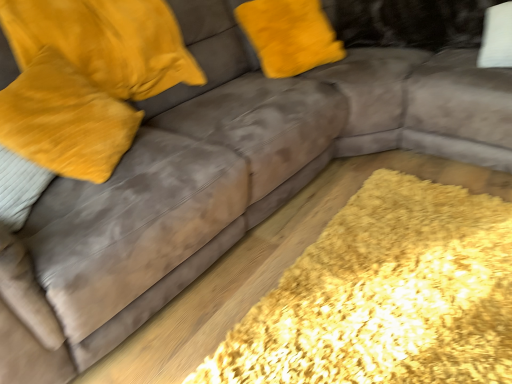
Question: Is yellow shaggy rug at lower right in front of velvet yellow pillow at left, which is counted as the first pillow, starting from the left?

Choices:
 (A) yes
 (B) no

Answer: (A)

Question: Considering the relative sizes of yellow shaggy rug at lower right and velvet yellow pillow at left, acting as the 2th pillow starting from the right, in the image provided, is yellow shaggy rug at lower right smaller than velvet yellow pillow at left, acting as the 2th pillow starting from the right,?

Choices:
 (A) yes
 (B) no

Answer: (A)

Question: Can you confirm if yellow shaggy rug at lower right is wider than velvet yellow pillow at left, which is counted as the first pillow, starting from the left?

Choices:
 (A) yes
 (B) no

Answer: (A)

Question: Is yellow shaggy rug at lower right oriented towards velvet yellow pillow at left, acting as the 2th pillow starting from the right?

Choices:
 (A) yes
 (B) no

Answer: (B)

Question: From a real-world perspective, is yellow shaggy rug at lower right on top of velvet yellow pillow at left, which is counted as the first pillow, starting from the left?

Choices:
 (A) yes
 (B) no

Answer: (B)

Question: Considering the relative positions of velvet yellow pillow at left, which is counted as the first pillow, starting from the left, and velvet yellow pillow at upper left, which appears as the 1th pillow when viewed from the right, in the image provided, is velvet yellow pillow at left, which is counted as the first pillow, starting from the left, to the left or to the right of velvet yellow pillow at upper left, which appears as the 1th pillow when viewed from the right,?

Choices:
 (A) left
 (B) right

Answer: (A)

Question: Based on their sizes in the image, would you say velvet yellow pillow at left, acting as the 2th pillow starting from the right, is bigger or smaller than velvet yellow pillow at upper left, the second pillow viewed from the left?

Choices:
 (A) big
 (B) small

Answer: (B)

Question: Is velvet yellow pillow at left, which is counted as the first pillow, starting from the left, in front of or behind velvet yellow pillow at upper left, which appears as the 1th pillow when viewed from the right, in the image?

Choices:
 (A) front
 (B) behind

Answer: (A)

Question: Is velvet yellow pillow at left, acting as the 2th pillow starting from the right, situated inside velvet yellow pillow at upper left, the second pillow viewed from the left, or outside?

Choices:
 (A) outside
 (B) inside

Answer: (A)

Question: Is velvet yellow pillow at upper left, the second pillow viewed from the left, situated inside velvet yellow pillow at left, which is counted as the first pillow, starting from the left, or outside?

Choices:
 (A) inside
 (B) outside

Answer: (B)

Question: Is velvet yellow pillow at upper left, the second pillow viewed from the left, in front of or behind velvet yellow pillow at left, acting as the 2th pillow starting from the right, in the image?

Choices:
 (A) front
 (B) behind

Answer: (B)

Question: From the image's perspective, is velvet yellow pillow at upper left, which appears as the 1th pillow when viewed from the right, located above or below velvet yellow pillow at left, which is counted as the first pillow, starting from the left?

Choices:
 (A) below
 (B) above

Answer: (B)

Question: In terms of height, does velvet yellow pillow at upper left, the second pillow viewed from the left, look taller or shorter compared to velvet yellow pillow at left, which is counted as the first pillow, starting from the left?

Choices:
 (A) short
 (B) tall

Answer: (A)

Question: In the image, is velvet yellow pillow at upper left, the second pillow viewed from the left, positioned in front of or behind yellow shaggy rug at lower right?

Choices:
 (A) behind
 (B) front

Answer: (A)

Question: In terms of height, does velvet yellow pillow at upper left, the second pillow viewed from the left, look taller or shorter compared to yellow shaggy rug at lower right?

Choices:
 (A) short
 (B) tall

Answer: (B)